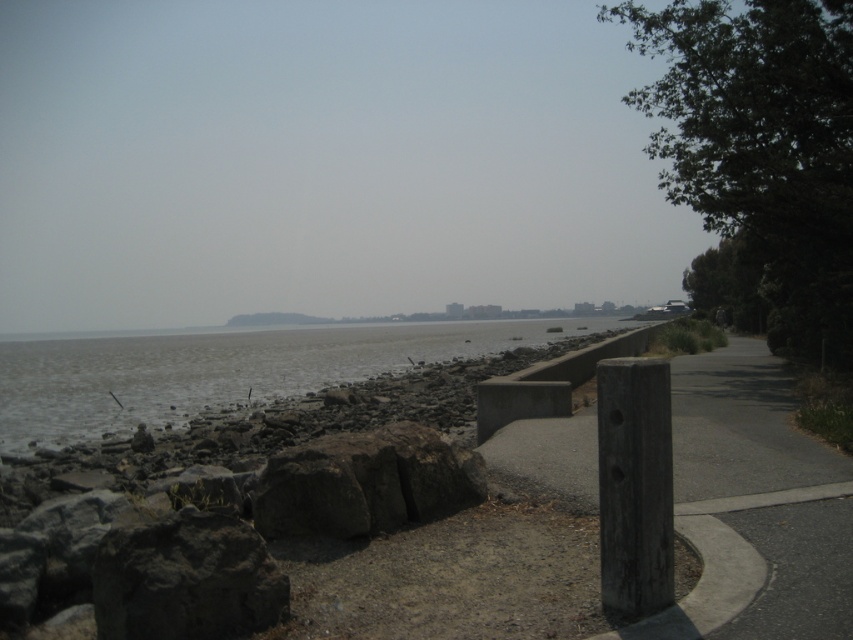
Question: Which object is closer to the camera taking this photo?

Choices:
 (A) dark gray rock at center
 (B) dark gray rough stone at lower left
 (C) gray stone water at center

Answer: (B)

Question: Which of the following is the closest to the observer?

Choices:
 (A) click(148, 636)
 (B) click(404, 483)

Answer: (A)

Question: Estimate the real-world distances between objects in this image. Which object is closer to the gray stone water at center?

Choices:
 (A) dark gray rough stone at lower left
 (B) dark gray rock at center

Answer: (A)

Question: Is dark gray rough stone at lower left positioned at the back of dark gray rock at center?

Choices:
 (A) no
 (B) yes

Answer: (A)

Question: Is dark gray rough stone at lower left thinner than dark gray rock at center?

Choices:
 (A) no
 (B) yes

Answer: (B)

Question: Does gray stone water at center have a smaller size compared to dark gray rough stone at lower left?

Choices:
 (A) no
 (B) yes

Answer: (A)